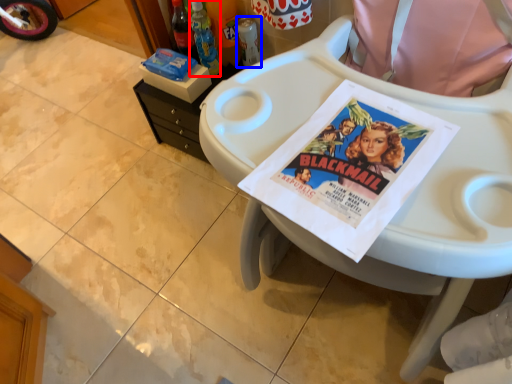
Question: Which object appears farthest to the camera in this image, bottle (highlighted by a red box) or bottle (highlighted by a blue box)?

Choices:
 (A) bottle
 (B) bottle

Answer: (B)